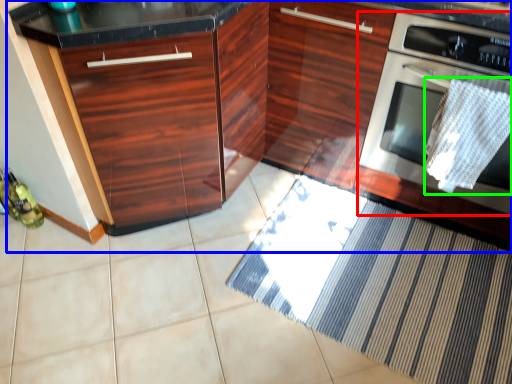
Question: Which object is positioned closest to home appliance (highlighted by a red box)? Select from cabinetry (highlighted by a blue box) and blanket (highlighted by a green box).

Choices:
 (A) cabinetry
 (B) blanket

Answer: (B)